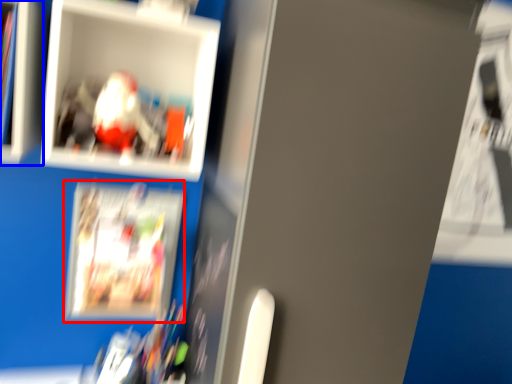
Question: Which of the following is the closest to the observer, magazine (highlighted by a red box) or cabinet (highlighted by a blue box)?

Choices:
 (A) magazine
 (B) cabinet

Answer: (B)